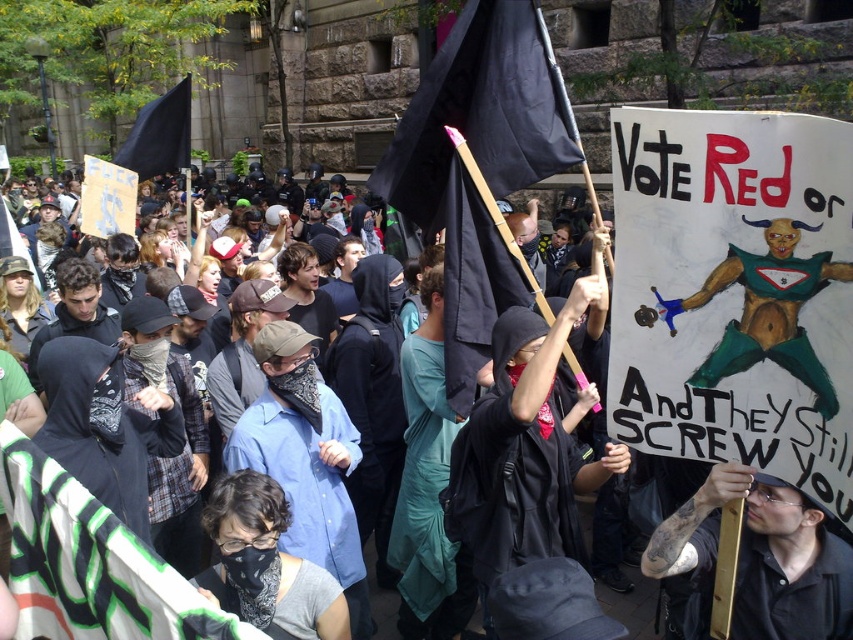
Between black leather jacket at center and black fabric flag at upper left, which one has more height?

With more height is black fabric flag at upper left.

This screenshot has width=853, height=640. What do you see at coordinates (762, 557) in the screenshot? I see `black leather jacket at center` at bounding box center [762, 557].

This screenshot has width=853, height=640. Describe the element at coordinates (762, 557) in the screenshot. I see `black leather jacket at center` at that location.

Find the location of a particular element. black leather jacket at center is located at coordinates (762, 557).